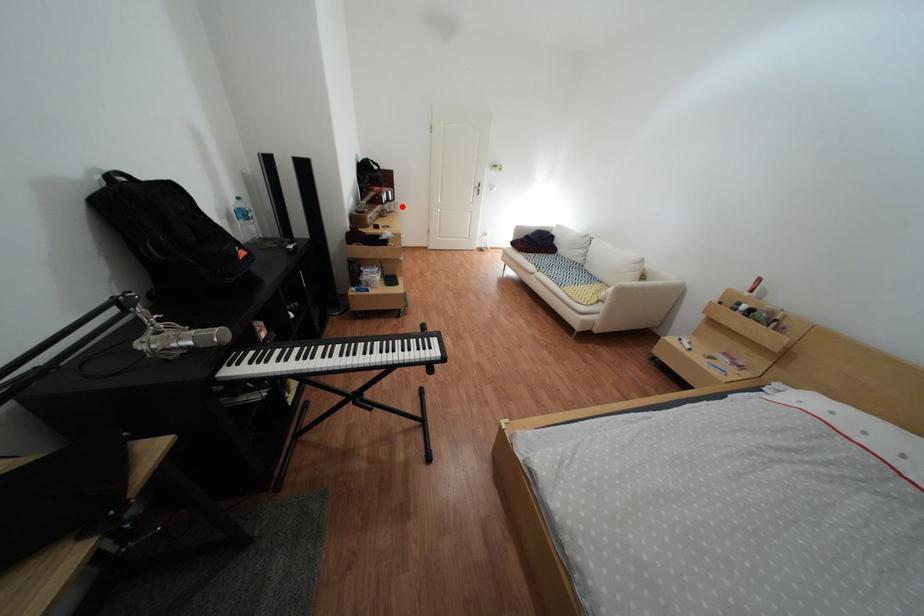
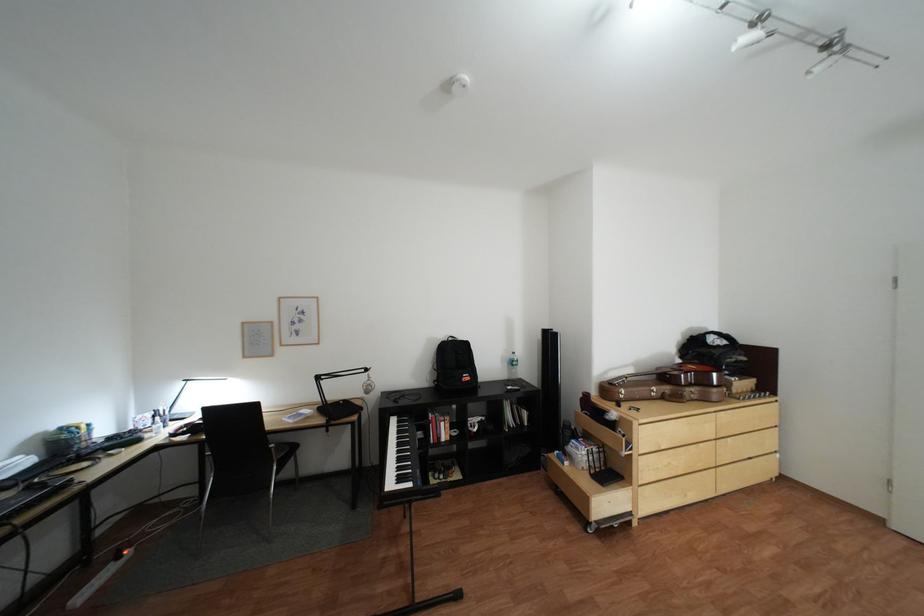
In the second image, find the point that corresponds to the highlighted location in the first image.

(703, 391)